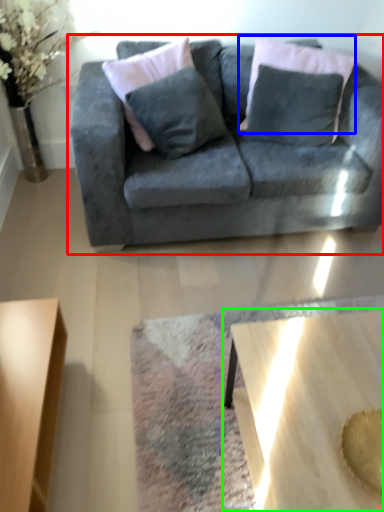
Question: Which object is positioned farthest from studio couch (highlighted by a red box)? Select from pillow (highlighted by a blue box) and coffee table (highlighted by a green box).

Choices:
 (A) pillow
 (B) coffee table

Answer: (B)